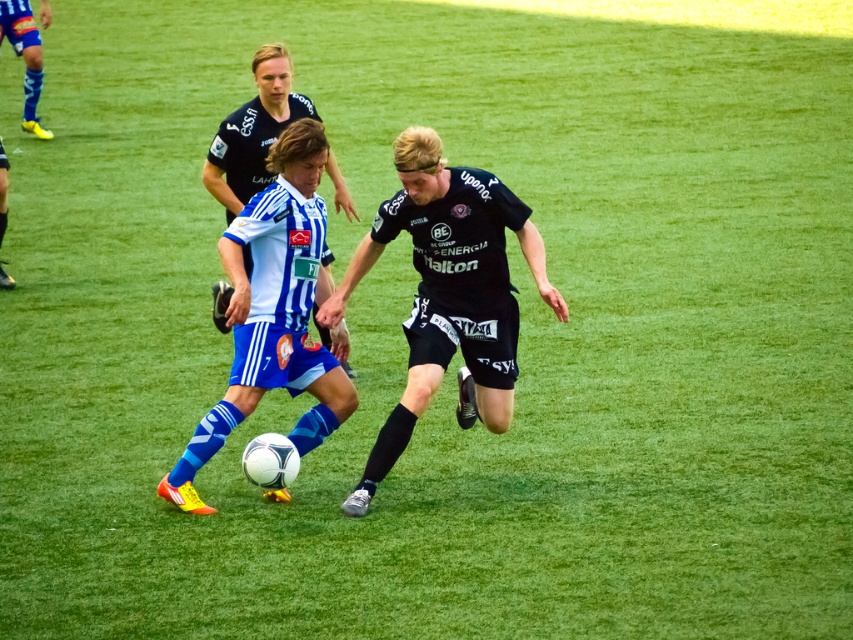
Measure the distance between point (299, 128) and camera.

The distance of point (299, 128) from camera is 8.02 meters.

Measure the distance between point (432, 305) and camera.

They are 8.24 meters apart.

At what (x,y) coordinates should I click in order to perform the action: click on white matte soccer ball at center. Please return your answer as a coordinate pair (x, y). This screenshot has height=640, width=853. Looking at the image, I should click on (350, 291).

Is white matte soccer ball at center closer to the viewer compared to white jersey at center?

Yes, it is.

Consider the image. Is white matte soccer ball at center thinner than white jersey at center?

Incorrect, white matte soccer ball at center's width is not less than white jersey at center's.

Is point (285, 314) closer to camera compared to point (222, 202)?

Yes, it is in front of point (222, 202).

Locate an element on the screen. This screenshot has width=853, height=640. white matte soccer ball at center is located at coordinates (350, 291).

Is black matte soccer ball at center closer to camera compared to white jersey at center?

Yes.

Is point (488, 230) more distant than point (323, 333)?

No.

Locate an element on the screen. The height and width of the screenshot is (640, 853). black matte soccer ball at center is located at coordinates (448, 292).